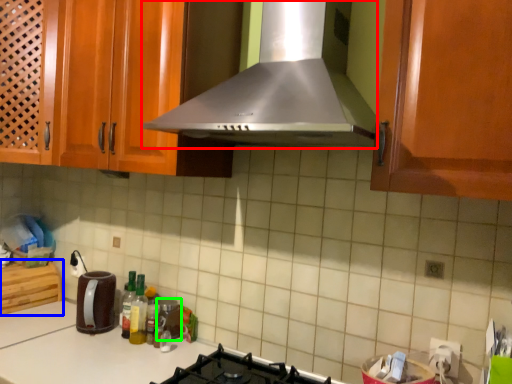
Question: Which is farther away from home appliance (highlighted by a red box)? cabinetry (highlighted by a blue box) or appliance (highlighted by a green box)?

Choices:
 (A) cabinetry
 (B) appliance

Answer: (A)